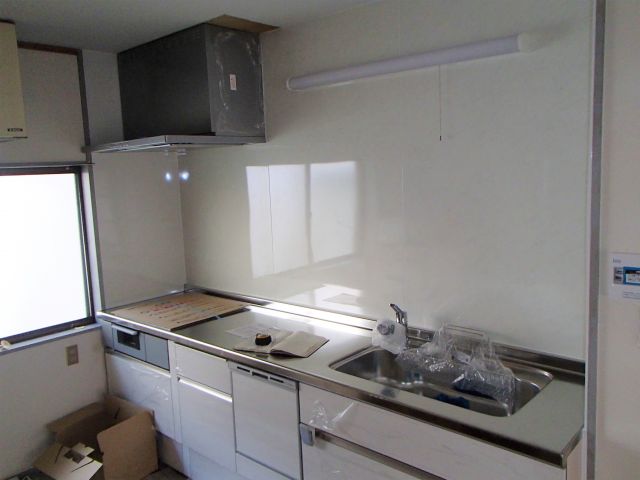
I want to click on outlet, so click(x=72, y=355).